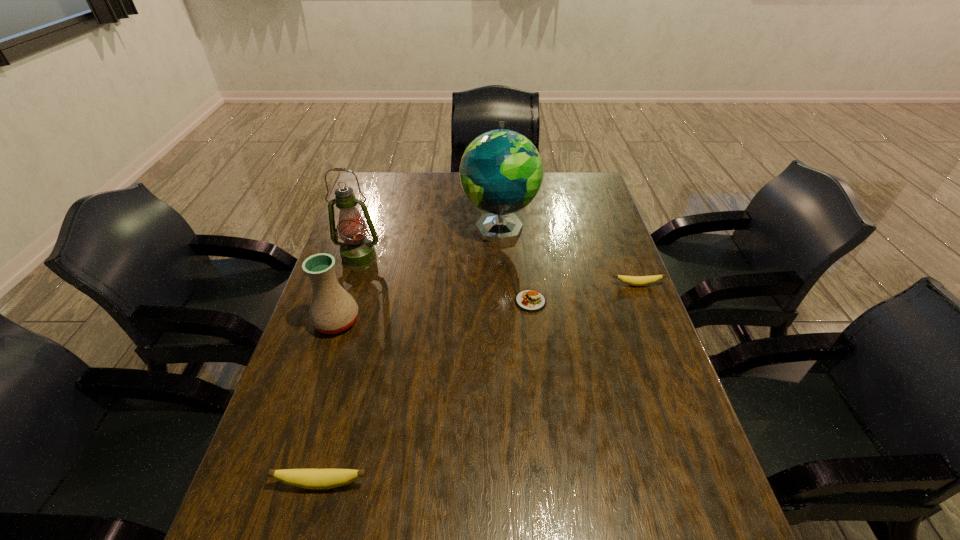
You are a GUI agent. You are given a task and a screenshot of the screen. Output one action in this format:
    pyautogui.click(x=<x>, y=<y>)
    Task: Click on the free space at the near edge of the desktop
    The image size is (960, 540).
    Given the screenshot: What is the action you would take?
    pyautogui.click(x=579, y=508)

I want to click on vacant space at the left edge of the desktop, so click(315, 449).

This screenshot has width=960, height=540. In the image, there is a desktop. Identify the location of vacant space at the right edge. (621, 352).

Where is `vacant position at the near left corner of the desktop`? The width and height of the screenshot is (960, 540). vacant position at the near left corner of the desktop is located at coordinates (318, 468).

Identify the location of free space that is in between the taller banana and the oil lamp. The width and height of the screenshot is (960, 540). (341, 371).

Find the location of `free space between the oil lamp and the pottery`. free space between the oil lamp and the pottery is located at coordinates (348, 290).

This screenshot has height=540, width=960. In order to click on unoccupied position between the farther banana and the nearest object in this screenshot , I will do `click(479, 384)`.

Find the location of a particular element. The image size is (960, 540). vacant space that's between the oil lamp and the nearest object is located at coordinates (341, 371).

At what (x,y) coordinates should I click in order to perform the action: click on free area in between the third tallest object and the third shortest object. Please return your answer as a coordinate pair (x, y). Looking at the image, I should click on (329, 402).

Where is `blank region between the oil lamp and the globe`? The height and width of the screenshot is (540, 960). blank region between the oil lamp and the globe is located at coordinates (429, 243).